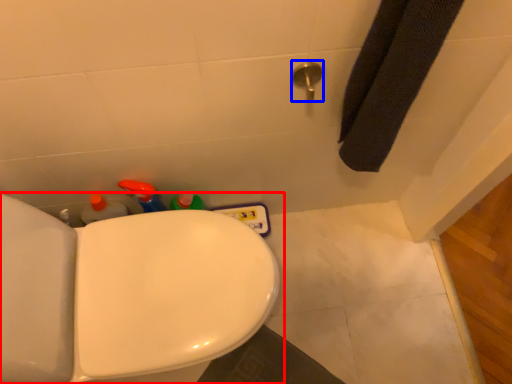
Question: Among these objects, which one is farthest to the camera, toilet (highlighted by a red box) or shower (highlighted by a blue box)?

Choices:
 (A) toilet
 (B) shower

Answer: (B)